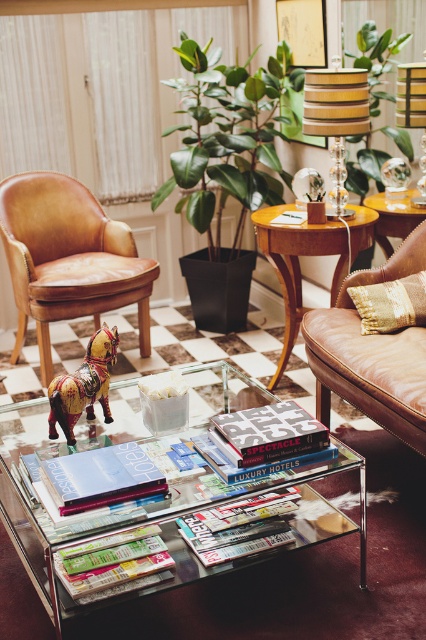
Question: Which object is closer to the camera taking this photo?

Choices:
 (A) matte brown leather armchair at left
 (B) matte silver magazine at center

Answer: (B)

Question: Estimate the real-world distances between objects in this image. Which object is closer to the hardcover magazine at center?

Choices:
 (A) matte hardcover book at center
 (B) matte plastic magazine at center
 (C) clear glass table at center

Answer: (C)

Question: In this image, where is clear glass table at center located relative to green leafy plant at upper center?

Choices:
 (A) right
 (B) left

Answer: (B)

Question: Can you confirm if clear glass table at center is wider than wooden side table at center?

Choices:
 (A) no
 (B) yes

Answer: (B)

Question: Can you confirm if matte silver magazine at center is smaller than green leafy plant at upper center?

Choices:
 (A) no
 (B) yes

Answer: (B)

Question: Which point is farther to the camera?

Choices:
 (A) clear glass table at center
 (B) matte brown leather armchair at left

Answer: (B)